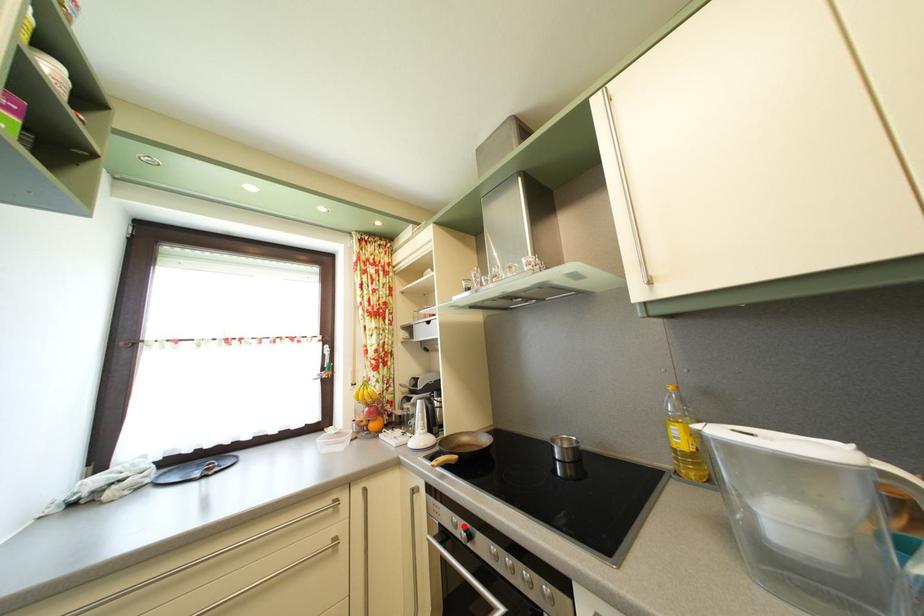
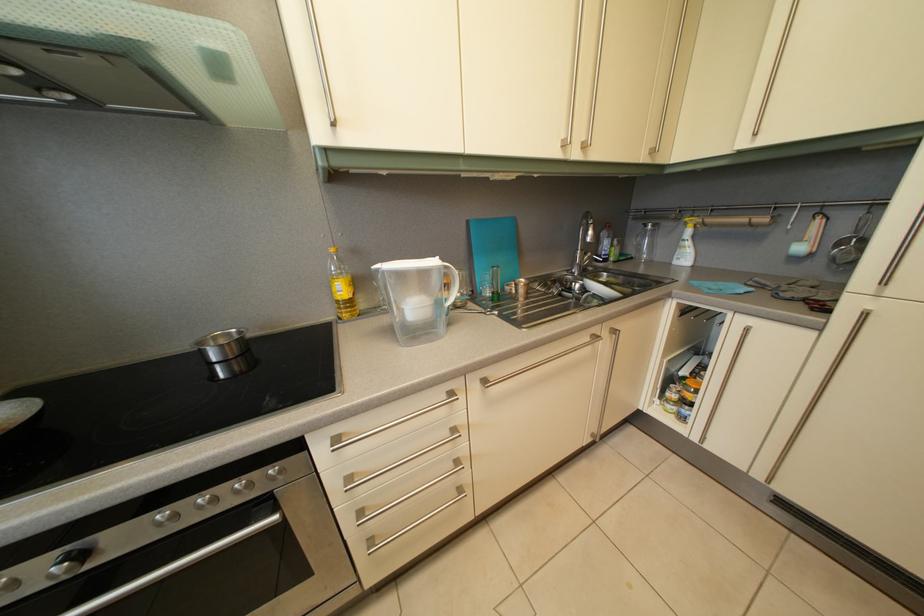
Question: I am providing you with two images of the same scene from different viewpoints. In image1, a red point is highlighted. Considering the same 3D point in image2, which of the following is correct?

Choices:
 (A) It is closer
 (B) It is farther

Answer: (A)